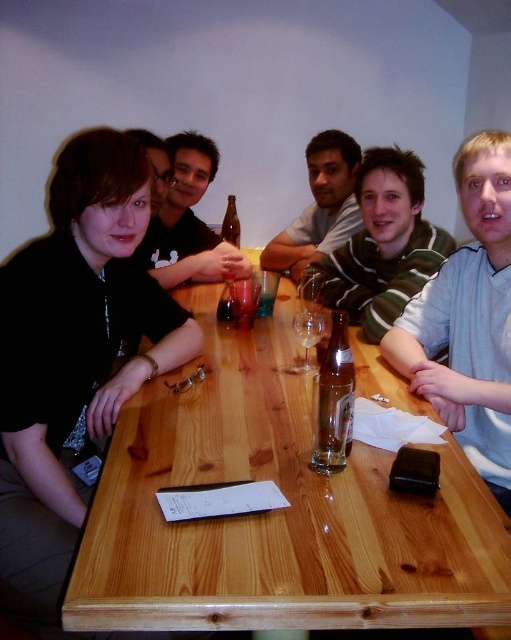
Between light brown wood table at center and clear glass bottle at center, which one appears on the left side from the viewer's perspective?

light brown wood table at center is more to the left.

Is light brown wood table at center wider than clear glass bottle at center?

Correct, the width of light brown wood table at center exceeds that of clear glass bottle at center.

What do you see at coordinates (275, 513) in the screenshot? This screenshot has height=640, width=511. I see `light brown wood table at center` at bounding box center [275, 513].

Identify the location of light brown wood table at center. The height and width of the screenshot is (640, 511). (275, 513).

Between green striped shirt at center and clear glass bottle at center, which one is positioned lower?

clear glass bottle at center

Who is more forward, (393, 148) or (338, 451)?

Point (338, 451) is in front.

The width and height of the screenshot is (511, 640). I want to click on green striped shirt at center, so click(383, 244).

Who is positioned more to the left, black matte shirt at left or matte gray shirt at center?

From the viewer's perspective, black matte shirt at left appears more on the left side.

Is black matte shirt at left below matte gray shirt at center?

Indeed, black matte shirt at left is positioned under matte gray shirt at center.

Which is behind, point (14, 561) or point (330, 182)?

Positioned behind is point (330, 182).

Image resolution: width=511 pixels, height=640 pixels. Find the location of `black matte shirt at left`. black matte shirt at left is located at coordinates (74, 355).